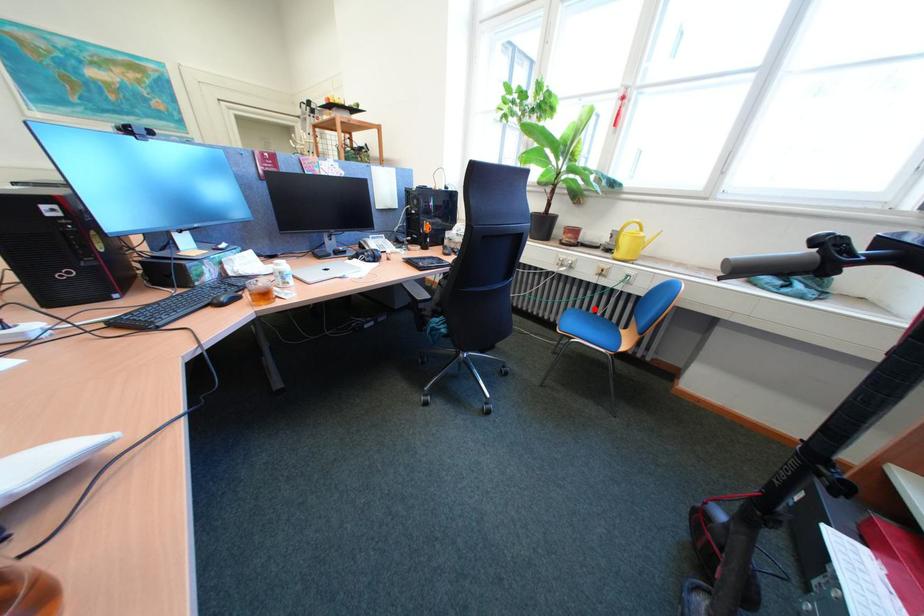
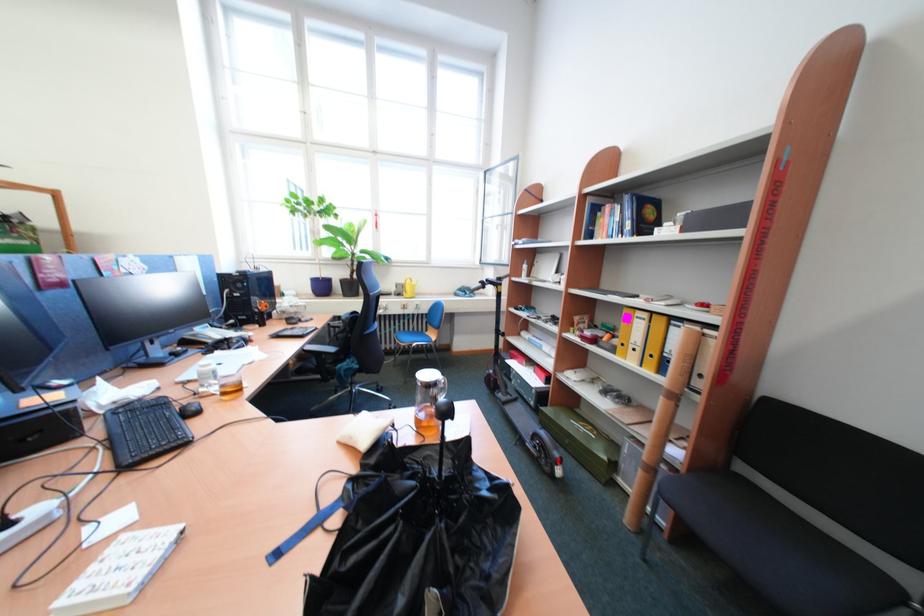
The point at the highlighted location is marked in the first image. Where is the corresponding point in the second image?

(415, 331)